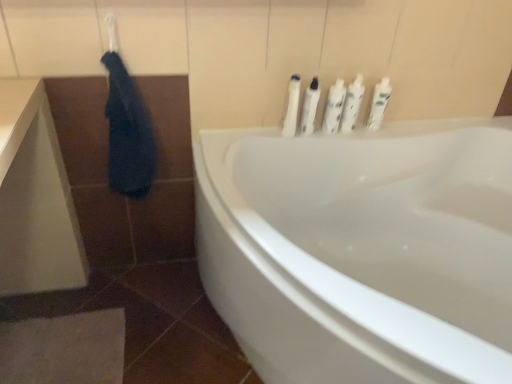
Locate an element on the screen. This screenshot has width=512, height=384. vacant space to the right of white glossy bottles at upper center, the fourth toiletry in the left-to-right sequence is located at coordinates (387, 129).